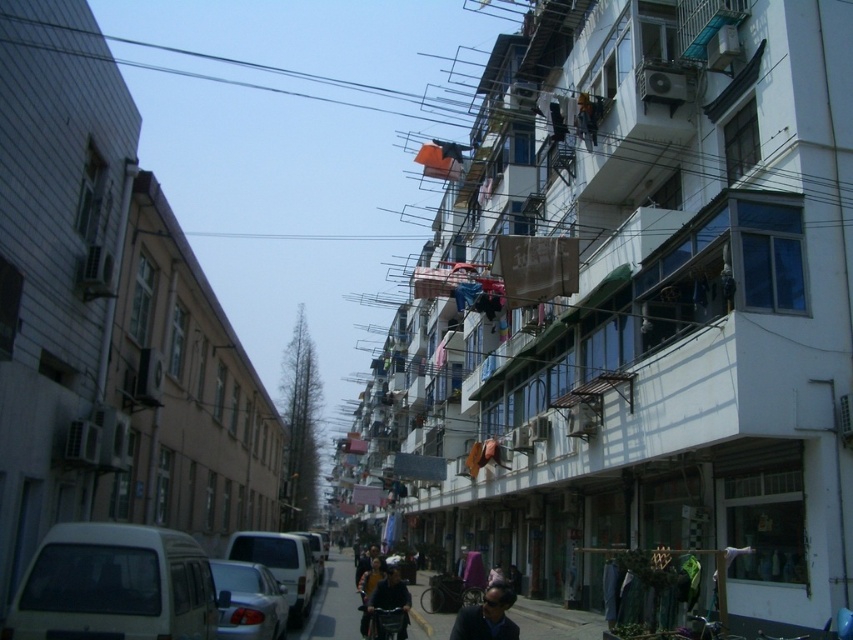
Does white matte van at lower left appear over black wire at upper left?

No.

Does point (144, 566) come closer to viewer compared to point (24, 17)?

Yes, point (144, 566) is in front of point (24, 17).

You are a GUI agent. You are given a task and a screenshot of the screen. Output one action in this format:
    pyautogui.click(x=<x>, y=<y>)
    Task: Click on the white matte van at lower left
    Image resolution: width=853 pixels, height=640 pixels.
    Given the screenshot: What is the action you would take?
    pyautogui.click(x=114, y=586)

Between point (450, 636) and point (399, 612), which one is positioned behind?

Positioned behind is point (450, 636).

Between point (506, 588) and point (384, 576), which one is positioned behind?

The point (384, 576) is behind.

At what (x,y) coordinates should I click in order to perform the action: click on dark blue fabric at lower center. Please return your answer as a coordinate pair (x, y). Looking at the image, I should click on (486, 616).

Does point (373, 86) come closer to viewer compared to point (248, 552)?

That is False.

Between point (172, 72) and point (282, 570), which one is positioned in front?

Point (282, 570) is more forward.

Where is `black wire at upper left`? The height and width of the screenshot is (640, 853). black wire at upper left is located at coordinates (224, 60).